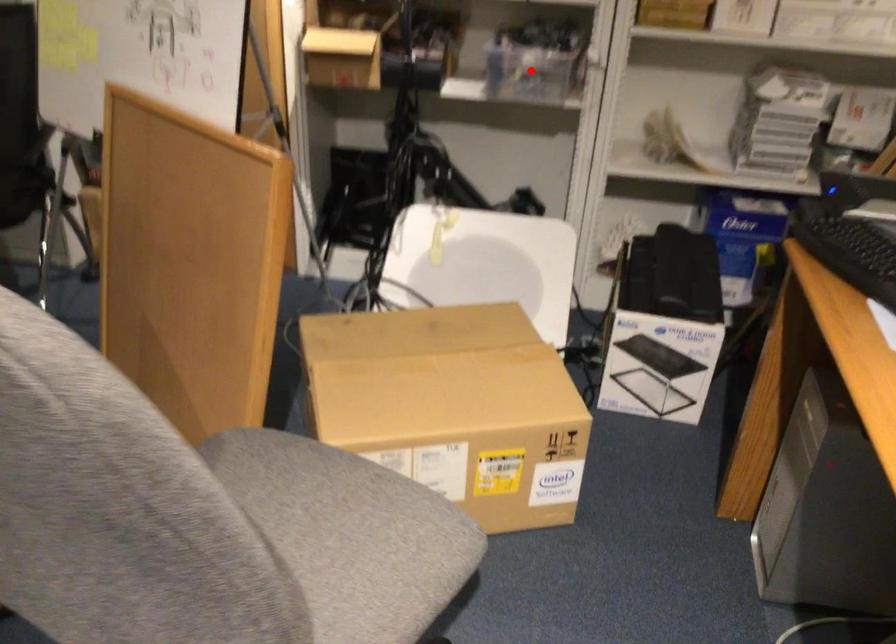
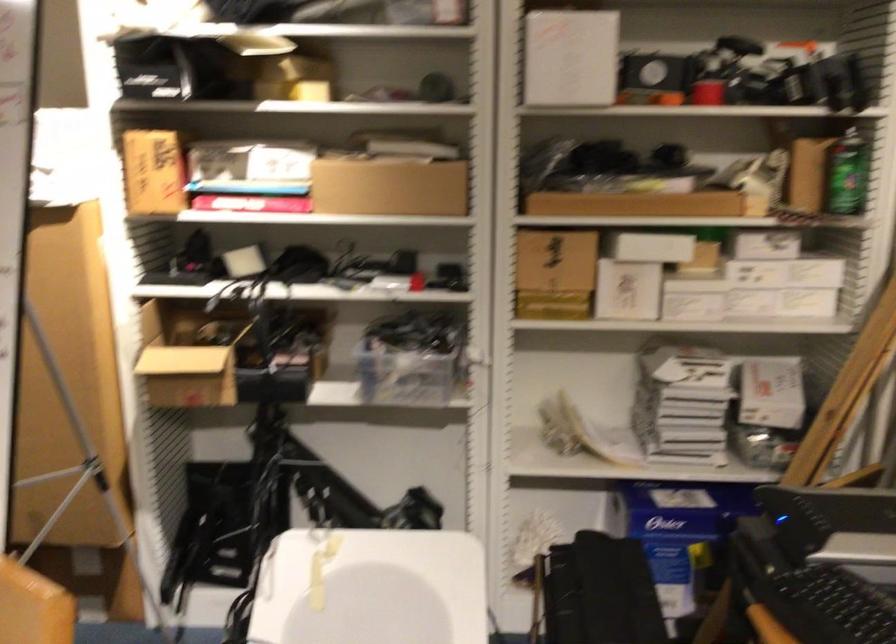
Question: I am providing you with two images of the same scene from different viewpoints. In image1, a red point is highlighted. Considering the same 3D point in image2, which of the following is correct?

Choices:
 (A) It is closer
 (B) It is farther

Answer: (A)